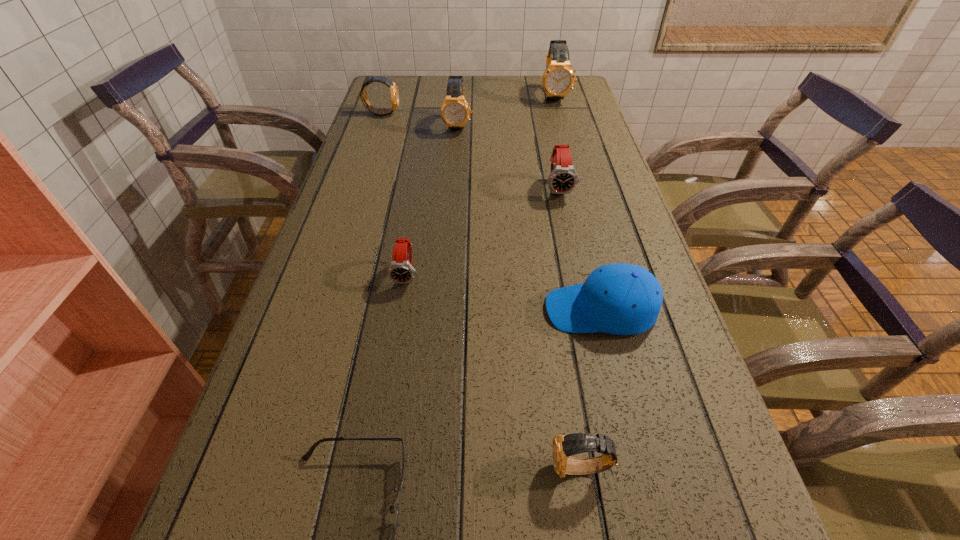
Locate an element on the screen. This screenshot has width=960, height=540. vacant space at the right edge of the desktop is located at coordinates (726, 465).

Identify the location of free point between the third nearest watch and the left red watch. click(483, 232).

This screenshot has height=540, width=960. Identify the location of unoccupied position between the nearest watch and the leftmost watch. (482, 291).

Image resolution: width=960 pixels, height=540 pixels. I want to click on free area in between the third nearest watch and the third biggest gold watch, so click(x=470, y=151).

You are a GUI agent. You are given a task and a screenshot of the screen. Output one action in this format:
    pyautogui.click(x=<x>, y=<y>)
    Task: Click on the unoccupied position between the second gold watch from right to left and the second nearest watch
    
    Given the screenshot: What is the action you would take?
    pyautogui.click(x=494, y=372)

Identify the location of vacant area between the second watch from left to right and the farther red watch. (483, 232).

Locate an element on the screen. This screenshot has height=540, width=960. vacant space that is in between the second nearest watch and the third watch from left to right is located at coordinates (433, 200).

At what (x,y) coordinates should I click in order to perform the action: click on free space between the leftmost watch and the right red watch. Please return your answer as a coordinate pair (x, y). The width and height of the screenshot is (960, 540). Looking at the image, I should click on (470, 151).

Identify the location of empty space between the nearest gold watch and the blue cap. The height and width of the screenshot is (540, 960). (590, 389).

In order to click on free point between the nearest gold watch and the leftmost gold watch in this screenshot , I will do `click(482, 291)`.